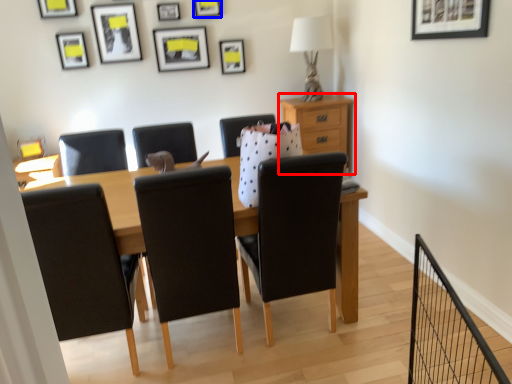
Question: Which object is closer to the camera taking this photo, nightstand (highlighted by a red box) or picture frame (highlighted by a blue box)?

Choices:
 (A) nightstand
 (B) picture frame

Answer: (B)